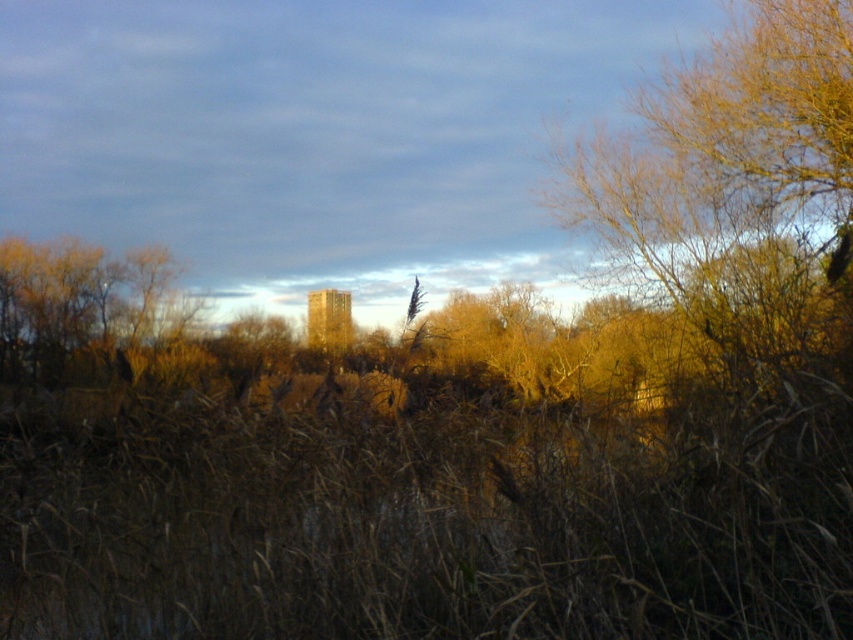
Which is below, brown dry grass at center or brown dry grass at left?

brown dry grass at center is lower down.

Who is positioned more to the left, brown dry grass at center or brown dry grass at left?

From the viewer's perspective, brown dry grass at left appears more on the left side.

You are a GUI agent. You are given a task and a screenshot of the screen. Output one action in this format:
    pyautogui.click(x=<x>, y=<y>)
    Task: Click on the brown dry grass at center
    
    Given the screenshot: What is the action you would take?
    pyautogui.click(x=440, y=528)

Is brown dry grass at center closer to camera compared to brown leafy tree at upper right?

Yes, it is.

Consider the image. Between brown dry grass at center and brown leafy tree at upper right, which one has less height?

brown dry grass at center

Does point (209, 432) come closer to viewer compared to point (846, 237)?

No, (209, 432) is behind (846, 237).

This screenshot has width=853, height=640. I want to click on brown dry grass at center, so click(x=440, y=528).

Which of these two, brown leafy tree at upper right or brown dry grass at left, stands taller?

With more height is brown leafy tree at upper right.

Which is in front, point (763, 81) or point (88, 326)?

Point (763, 81) is in front.

Does point (601, 138) lie in front of point (186, 305)?

Yes, it is.

The width and height of the screenshot is (853, 640). I want to click on brown leafy tree at upper right, so click(728, 148).